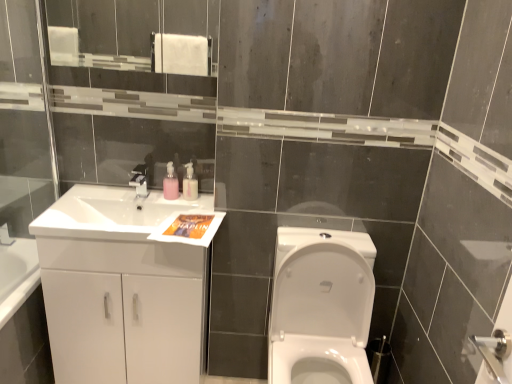
Question: From a real-world perspective, relative to white glossy sink at left, is pink matte soap dispenser at upper center, positioned as the 2th soap dispenser in right-to-left order, vertically above or below?

Choices:
 (A) above
 (B) below

Answer: (A)

Question: Based on their positions, is pink matte soap dispenser at upper center, positioned as the 2th soap dispenser in right-to-left order, located to the left or right of white glossy sink at left?

Choices:
 (A) right
 (B) left

Answer: (A)

Question: Which object is positioned farthest from the pink matte soap dispenser at upper center, arranged as the 1th soap dispenser when viewed from the left?

Choices:
 (A) pink plastic soap dispenser at upper center, marked as the first soap dispenser in a right-to-left arrangement
 (B) white glossy sink at left
 (C) white glossy toilet at center
 (D) white glossy cabinet at left
 (E) transparent glass door at left

Answer: (C)

Question: Which of these objects is positioned closest to the pink plastic soap dispenser at upper center, marked as the 2th soap dispenser in a left-to-right arrangement?

Choices:
 (A) white glossy cabinet at left
 (B) transparent glass door at left
 (C) white glossy toilet at center
 (D) white glossy sink at left
 (E) matte silver faucet at upper center

Answer: (E)